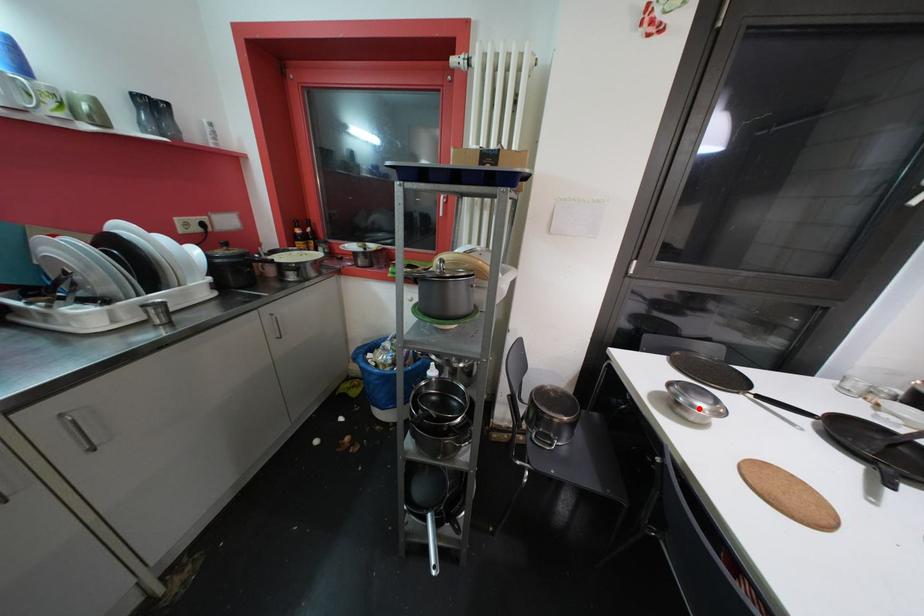
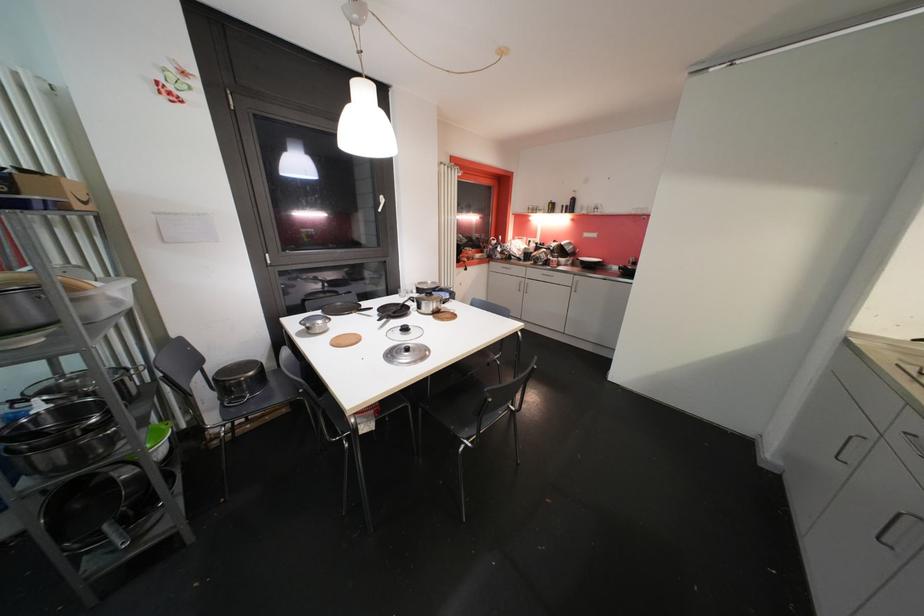
Locate, in the second image, the point that corresponds to the highlighted location in the first image.

(319, 328)